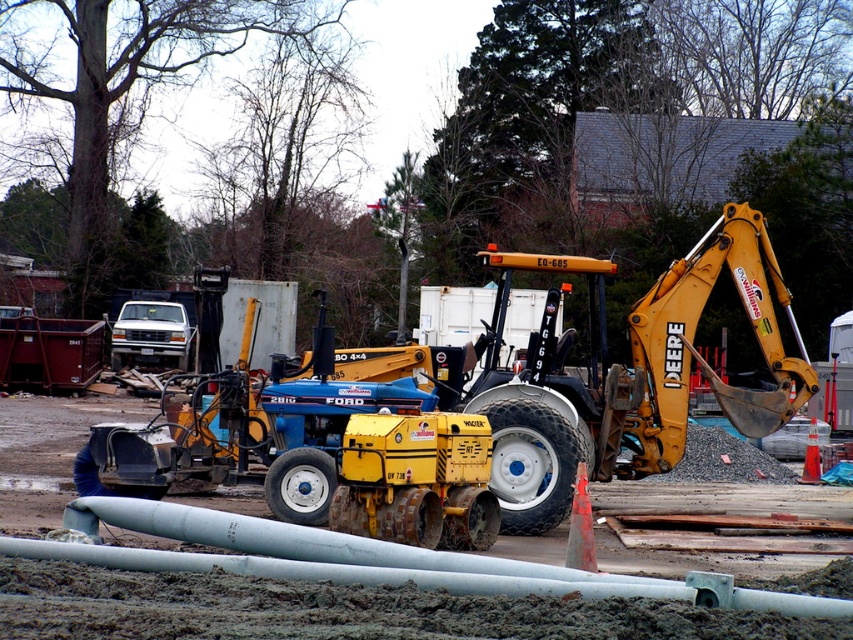
Question: Does yellow rubber tractor at center appear on the right side of yellow metal excavator at center right?

Choices:
 (A) no
 (B) yes

Answer: (A)

Question: Can you confirm if yellow rubber tractor at center is smaller than yellow metal excavator at center right?

Choices:
 (A) yes
 (B) no

Answer: (B)

Question: Which of the following is the farthest from the observer?

Choices:
 (A) yellow rubber tractor at center
 (B) yellow metal excavator at center right

Answer: (B)

Question: Can you confirm if yellow rubber tractor at center is smaller than yellow metal excavator at center right?

Choices:
 (A) no
 (B) yes

Answer: (A)